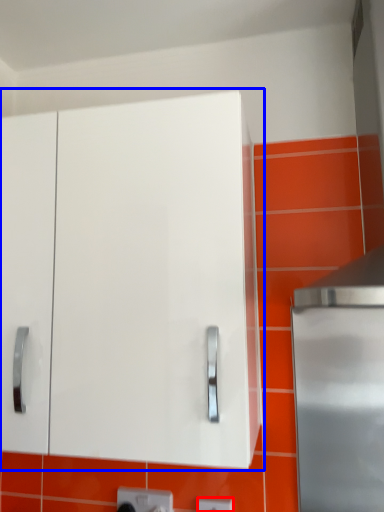
Question: Which of the following is the farthest to the observer, electric outlet (highlighted by a red box) or cabinetry (highlighted by a blue box)?

Choices:
 (A) electric outlet
 (B) cabinetry

Answer: (A)